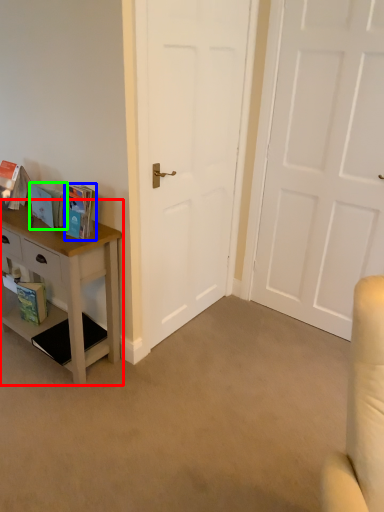
Question: Based on their relative distances, which object is nearer to nightstand (highlighted by a red box)? Choose from book (highlighted by a blue box) and book (highlighted by a green box).

Choices:
 (A) book
 (B) book

Answer: (B)